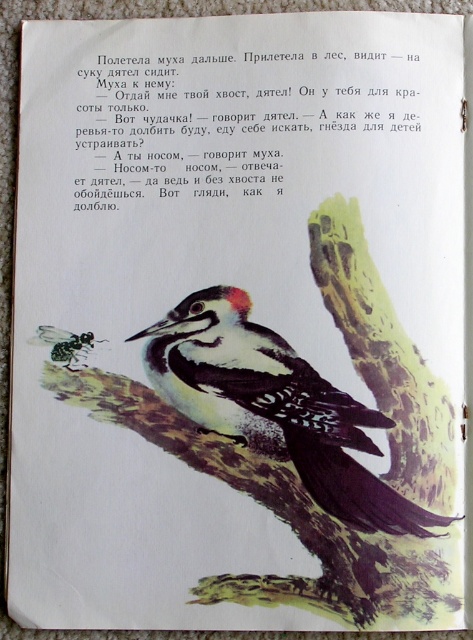
Is speckled feathered woodpecker at center shorter than black glossy ant at lower left?

In fact, speckled feathered woodpecker at center may be taller than black glossy ant at lower left.

Which is more to the right, speckled feathered woodpecker at center or black glossy ant at lower left?

speckled feathered woodpecker at center

The image size is (473, 640). Describe the element at coordinates (274, 406) in the screenshot. I see `speckled feathered woodpecker at center` at that location.

Identify the location of speckled feathered woodpecker at center. (274, 406).